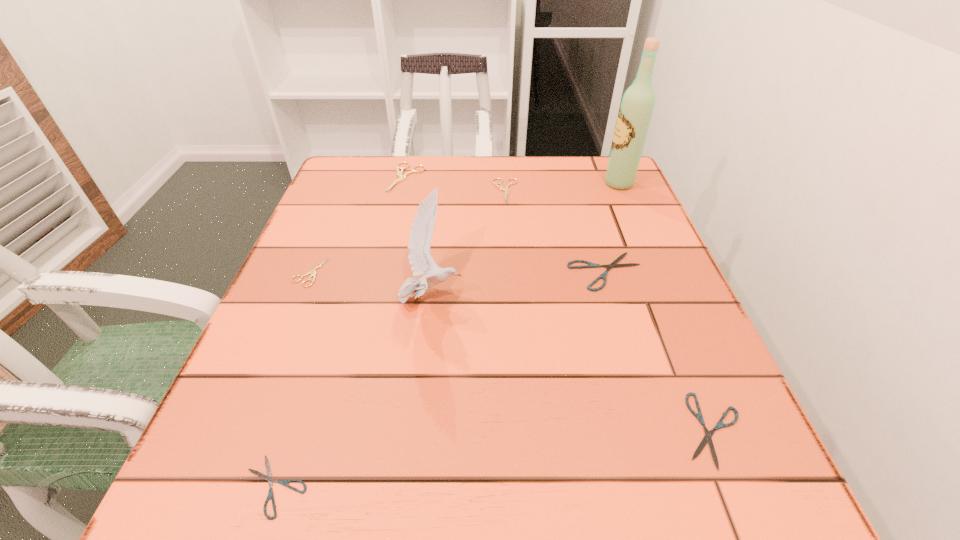
This screenshot has height=540, width=960. In order to click on vacant area at the far edge of the desktop in this screenshot , I will do `click(482, 160)`.

Image resolution: width=960 pixels, height=540 pixels. Find the location of `free space at the left edge of the desktop`. free space at the left edge of the desktop is located at coordinates (286, 400).

The image size is (960, 540). What are the coordinates of `vacant area at the right edge of the desktop` in the screenshot? It's located at click(663, 381).

Where is `vacant space at the far left corner`? vacant space at the far left corner is located at coordinates (374, 160).

Find the location of a particular element. The width and height of the screenshot is (960, 540). vacant space at the near left corner is located at coordinates (205, 467).

In the image, there is a desktop. Identify the location of free region at the far right corner. Image resolution: width=960 pixels, height=540 pixels. (596, 159).

Where is `vacant space in between the smallest beige shears and the biggest black shears`? The height and width of the screenshot is (540, 960). vacant space in between the smallest beige shears and the biggest black shears is located at coordinates (458, 272).

Identify the location of free space between the second smallest black shears and the tallest object. This screenshot has width=960, height=540. (665, 307).

At what (x,y) coordinates should I click in order to perform the action: click on free point between the biggest black shears and the tallest object. Please return your answer as a coordinate pair (x, y). Image resolution: width=960 pixels, height=540 pixels. Looking at the image, I should click on 612,227.

You are a GUI agent. You are given a task and a screenshot of the screen. Output one action in this format:
    pyautogui.click(x=<x>, y=<y>)
    Task: Click on the free space between the biggest black shears and the second biggest black shears
    The image size is (960, 540).
    Given the screenshot: What is the action you would take?
    pyautogui.click(x=660, y=350)